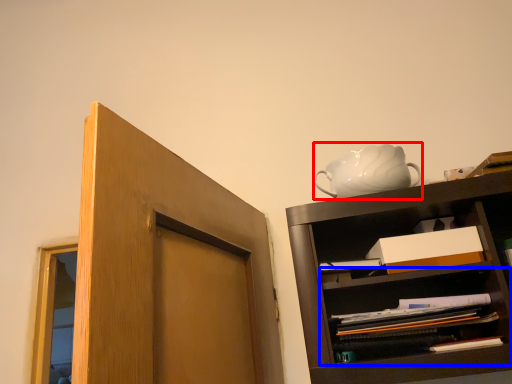
Question: Which point is closer to the camera, tea pot (highlighted by a red box) or shelf (highlighted by a blue box)?

Choices:
 (A) tea pot
 (B) shelf

Answer: (B)